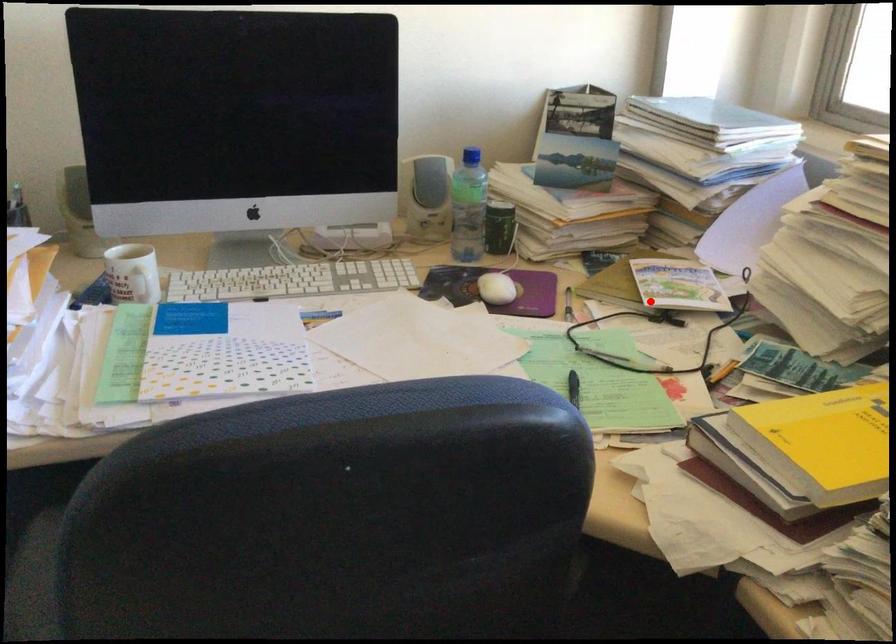
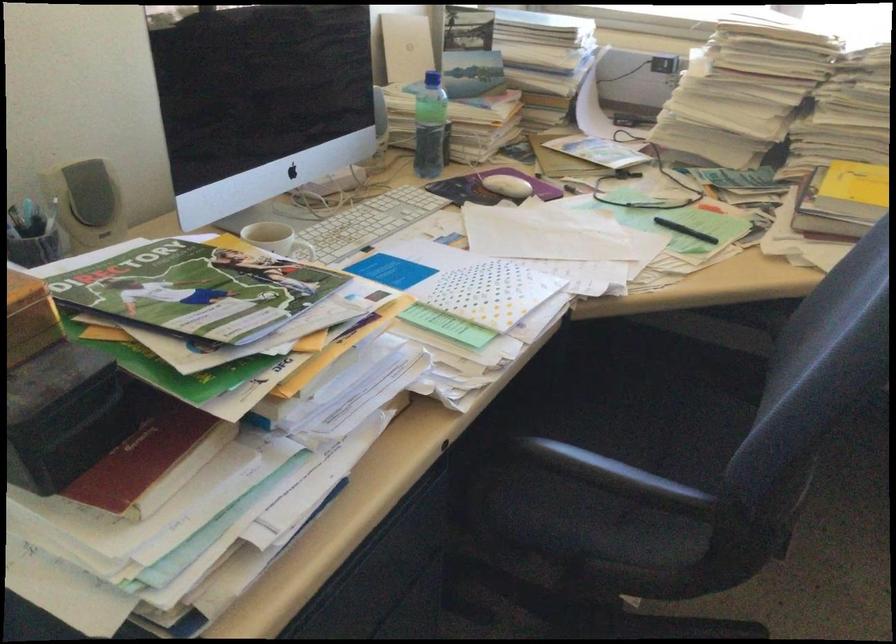
Question: I am providing you with two images of the same scene from different viewpoints. A red point is shown in image1. For the corresponding object point in image2, is it positioned nearer or farther from the camera?

Choices:
 (A) Nearer
 (B) Farther

Answer: (B)